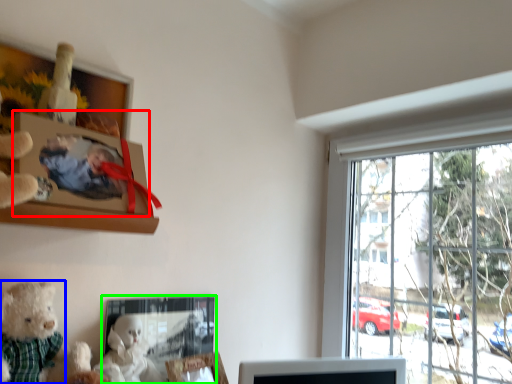
Question: Which is farther away from picture frame (highlighted by a red box)? teddy bear (highlighted by a blue box) or picture frame (highlighted by a green box)?

Choices:
 (A) teddy bear
 (B) picture frame

Answer: (B)